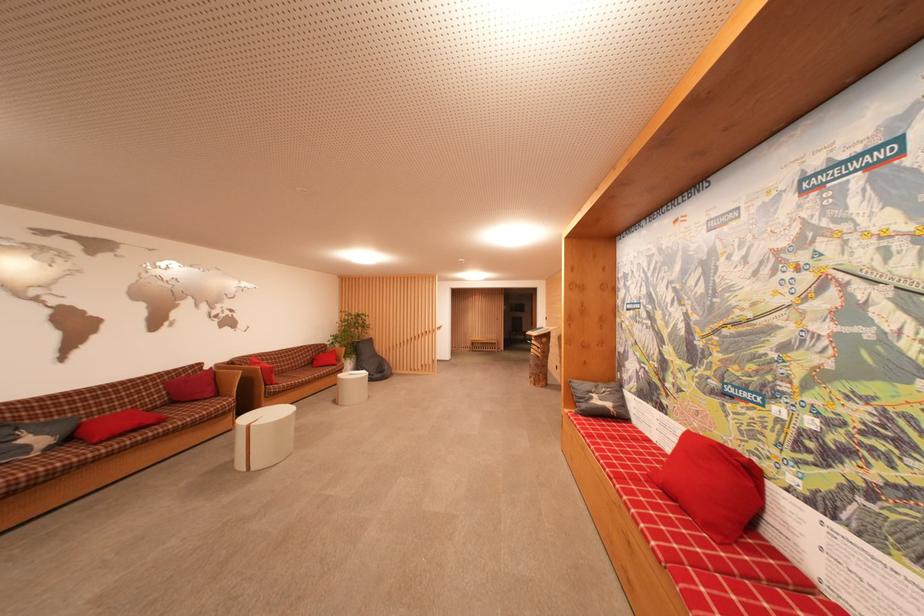
Find where to sit the red bench sitting surface. Please return your answer as a coordinate pair (x, y).

(625, 456)